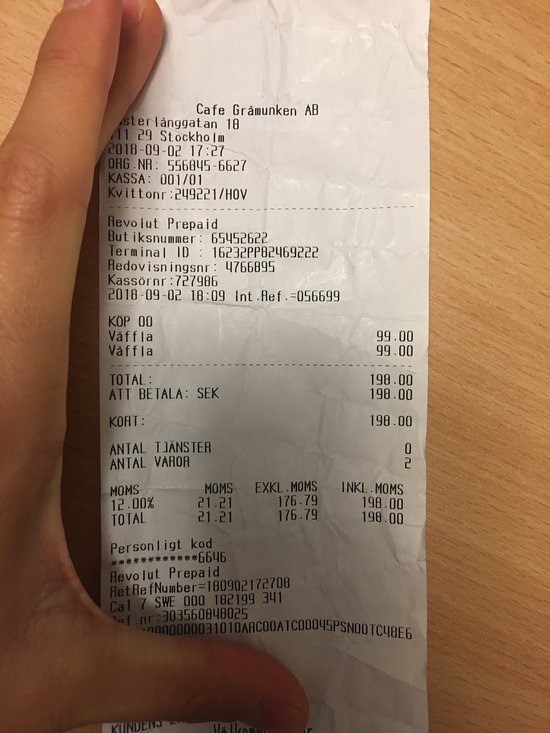
Identify the location of tan wooden background surface. The height and width of the screenshot is (733, 550). (478, 586), (478, 412), (478, 158), (29, 26).